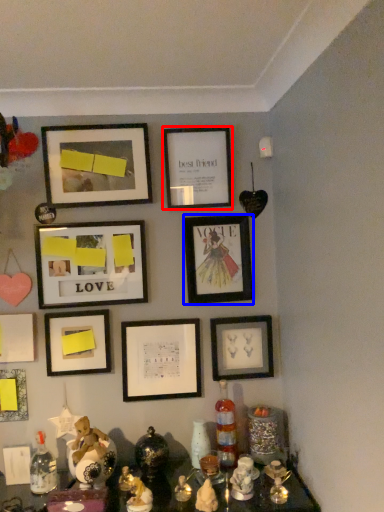
Question: Which of the following is the farthest to the observer, picture frame (highlighted by a red box) or picture frame (highlighted by a blue box)?

Choices:
 (A) picture frame
 (B) picture frame

Answer: (B)